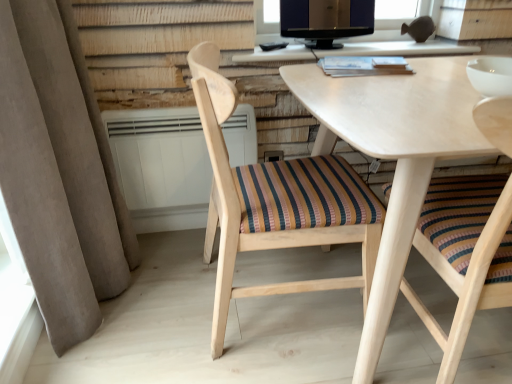
Question: Is matte black monitor at upper center to the left of light wood table at upper center from the viewer's perspective?

Choices:
 (A) no
 (B) yes

Answer: (B)

Question: Considering the relative sizes of matte black monitor at upper center and light wood table at upper center in the image provided, is matte black monitor at upper center bigger than light wood table at upper center?

Choices:
 (A) no
 (B) yes

Answer: (A)

Question: Is matte black monitor at upper center in front of light wood table at upper center?

Choices:
 (A) no
 (B) yes

Answer: (B)

Question: Considering the relative positions of matte black monitor at upper center and light wood table at upper center in the image provided, is matte black monitor at upper center behind light wood table at upper center?

Choices:
 (A) no
 (B) yes

Answer: (A)

Question: Is matte black monitor at upper center far from light wood table at upper center?

Choices:
 (A) yes
 (B) no

Answer: (B)

Question: Is matte black monitor at upper center positioned beyond the bounds of light wood table at upper center?

Choices:
 (A) no
 (B) yes

Answer: (B)

Question: Is beige fabric curtain at left turned away from light wood table at upper center?

Choices:
 (A) no
 (B) yes

Answer: (A)

Question: From a real-world perspective, does beige fabric curtain at left stand above light wood table at upper center?

Choices:
 (A) yes
 (B) no

Answer: (B)

Question: Could you tell me if beige fabric curtain at left is turned towards light wood table at upper center?

Choices:
 (A) no
 (B) yes

Answer: (B)

Question: From the image's perspective, is beige fabric curtain at left on light wood table at upper center?

Choices:
 (A) no
 (B) yes

Answer: (A)

Question: Does beige fabric curtain at left come in front of light wood table at upper center?

Choices:
 (A) no
 (B) yes

Answer: (B)

Question: Can you confirm if beige fabric curtain at left is thinner than light wood table at upper center?

Choices:
 (A) yes
 (B) no

Answer: (B)

Question: Is wooden chair with striped cushion at center, positioned as the first chair in left-to-right order, touching white plastic radiator at center?

Choices:
 (A) no
 (B) yes

Answer: (A)